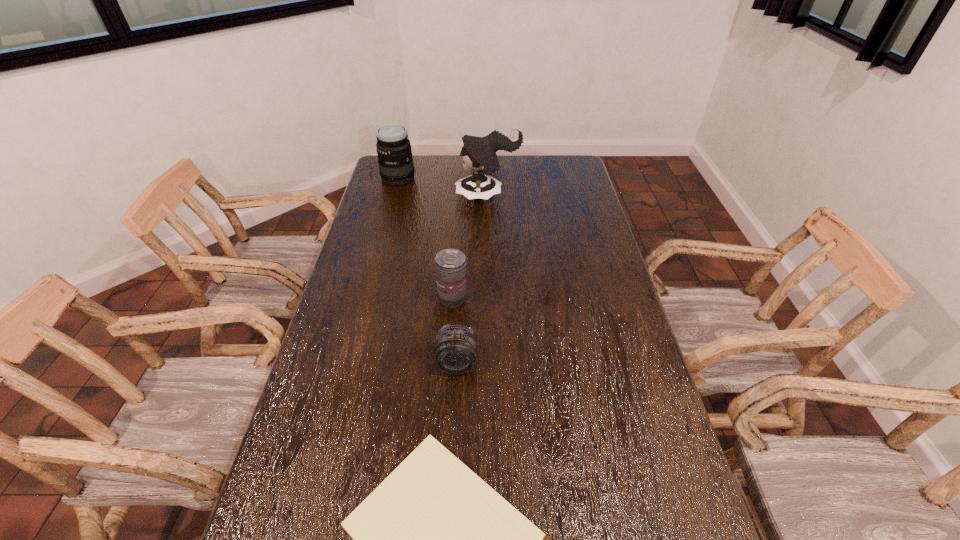
You are a GUI agent. You are given a task and a screenshot of the screen. Output one action in this format:
    pyautogui.click(x=<x>, y=<y>)
    Task: Click on the unoccupied area between the doll and the leftmost telephoto lens
    The height and width of the screenshot is (540, 960).
    Given the screenshot: What is the action you would take?
    pyautogui.click(x=443, y=187)

Locate an element on the screen. This screenshot has height=540, width=960. vacant area that lies between the second tallest telephoto lens and the leftmost telephoto lens is located at coordinates (425, 239).

Image resolution: width=960 pixels, height=540 pixels. Identify the location of unoccupied area between the leftmost telephoto lens and the third farthest object. (425, 239).

Image resolution: width=960 pixels, height=540 pixels. What are the coordinates of `vacant area between the tallest telephoto lens and the second farthest telephoto lens` in the screenshot? It's located at (425, 239).

Where is `free space between the second shortest telephoto lens and the tallest object`? The height and width of the screenshot is (540, 960). free space between the second shortest telephoto lens and the tallest object is located at coordinates (470, 248).

Point out which object is positioned as the third nearest to the tallest object. Please provide its 2D coordinates. Your answer should be formatted as a tuple, i.e. [(x, y)], where the tuple contains the x and y coordinates of a point satisfying the conditions above.

[(455, 348)]

This screenshot has height=540, width=960. Find the location of `object that is the third closest to the tallest object`. object that is the third closest to the tallest object is located at coordinates (455, 348).

Choose which telephoto lens is the second nearest neighbor to the shortest telephoto lens. Please provide its 2D coordinates. Your answer should be formatted as a tuple, i.e. [(x, y)], where the tuple contains the x and y coordinates of a point satisfying the conditions above.

[(396, 167)]

Select which telephoto lens appears as the second closest to the shortest object. Please provide its 2D coordinates. Your answer should be formatted as a tuple, i.e. [(x, y)], where the tuple contains the x and y coordinates of a point satisfying the conditions above.

[(450, 264)]